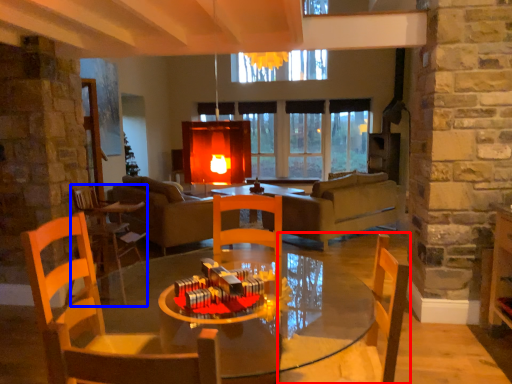
Question: Which of the following is the closest to the observer, chair (highlighted by a red box) or chair (highlighted by a blue box)?

Choices:
 (A) chair
 (B) chair

Answer: (A)